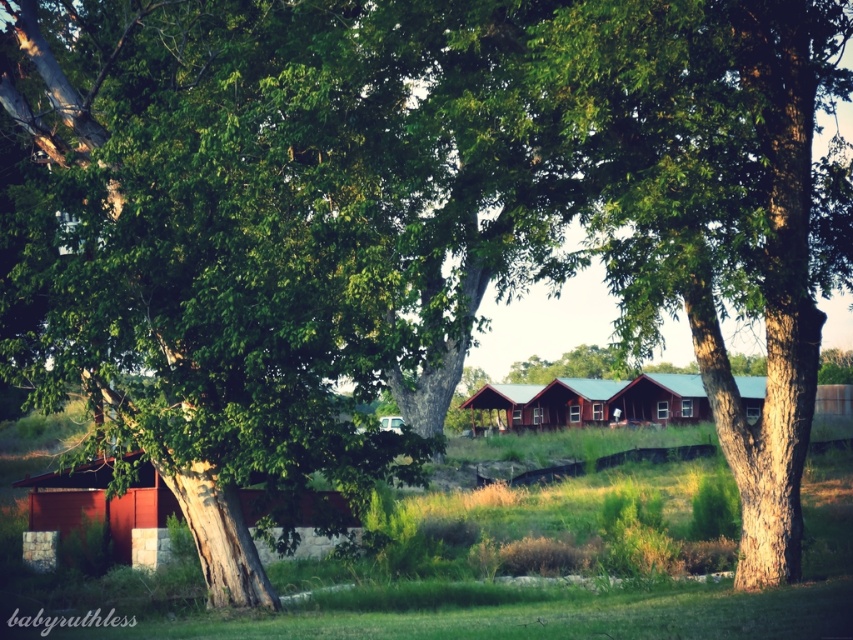
Question: Can you confirm if matte red cabin at lower left is positioned to the left of metallic red cabin at center?

Choices:
 (A) no
 (B) yes

Answer: (B)

Question: Does matte red cabin at lower left have a lesser width compared to matte red cabin at center?

Choices:
 (A) yes
 (B) no

Answer: (B)

Question: Which object is positioned farthest from the green wooden cabin at center?

Choices:
 (A) metallic red cabin at center
 (B) matte red cabin at lower left

Answer: (B)

Question: Can you confirm if matte red cabin at center is wider than metallic red cabin at center?

Choices:
 (A) yes
 (B) no

Answer: (B)

Question: Which object is positioned farthest from the matte red cabin at lower left?

Choices:
 (A) green wooden cabin at center
 (B) matte red cabin at center
 (C) metallic red cabin at center

Answer: (B)

Question: Which object is farther from the camera taking this photo?

Choices:
 (A) matte red cabin at center
 (B) matte red cabin at lower left

Answer: (A)